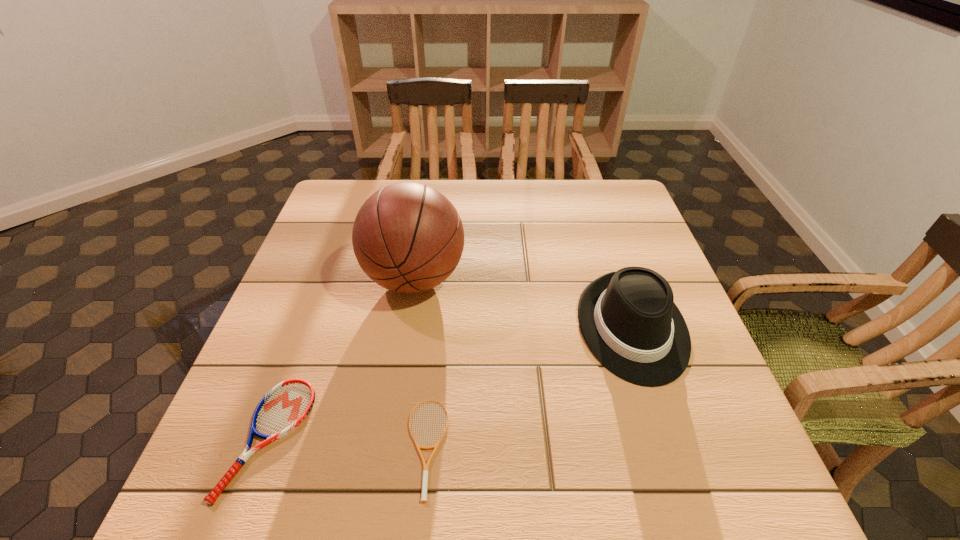
Select which object appears as the closest to the right tennis racket. Please provide its 2D coordinates. Your answer should be formatted as a tuple, i.e. [(x, y)], where the tuple contains the x and y coordinates of a point satisfying the conditions above.

[(285, 406)]

I want to click on the third closest object to the taller tennis racket, so click(628, 319).

The height and width of the screenshot is (540, 960). I want to click on vacant area that satisfies the following two spatial constraints: 1. on the front side of the shortest object; 2. on the left side of the tallest object, so click(388, 448).